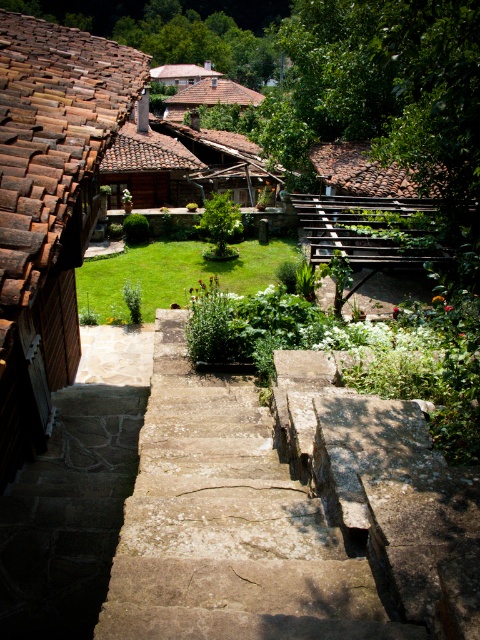
Question: Considering the real-world distances, which object is closest to the brown tile roof at upper center?

Choices:
 (A) stone stairs at center
 (B) rustic stone steps at center

Answer: (B)

Question: Among these objects, which one is nearest to the camera?

Choices:
 (A) rustic clay roof tiles at left
 (B) stone stairs at center
 (C) brown tiled roof at upper center
 (D) brown tile roof at upper center

Answer: (B)

Question: Is stone stairs at center to the right of brown tiled roof at upper center from the viewer's perspective?

Choices:
 (A) yes
 (B) no

Answer: (A)

Question: Where is rustic stone steps at center located in relation to brown tile roof at upper center in the image?

Choices:
 (A) above
 (B) below

Answer: (B)

Question: Estimate the real-world distances between objects in this image. Which object is closer to the brown tile roof at upper center?

Choices:
 (A) rustic clay roof tiles at left
 (B) stone stairs at center
 (C) brown tiled roof at upper center
 (D) rustic stone steps at center

Answer: (C)

Question: Is the position of rustic stone steps at center less distant than that of brown tile roof at upper center?

Choices:
 (A) no
 (B) yes

Answer: (B)